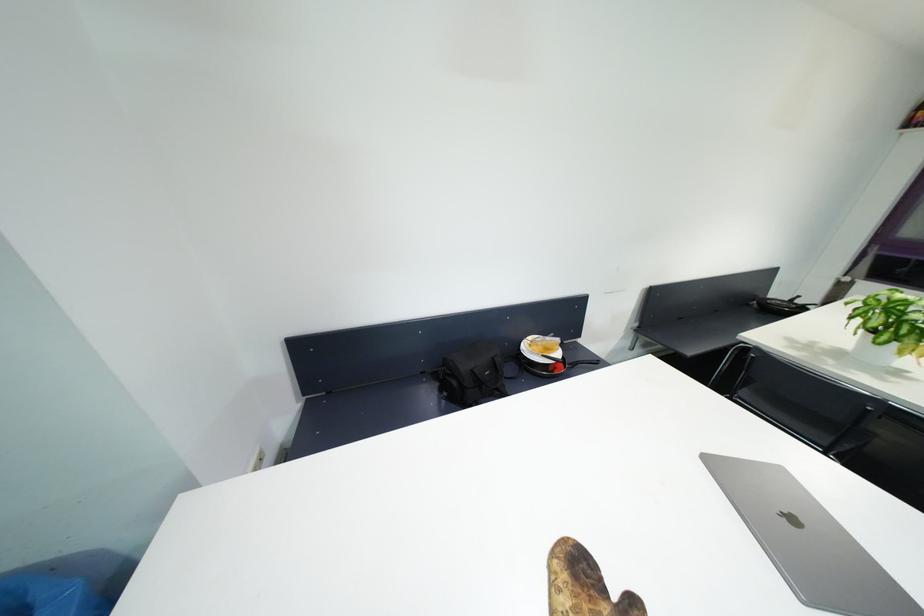
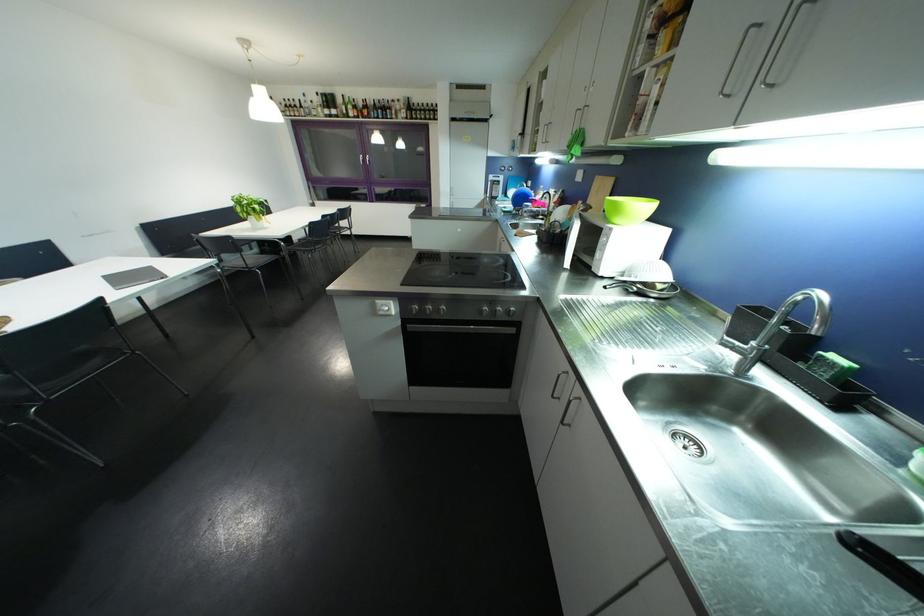
Question: I am providing you with two images of the same scene from different viewpoints. Which of the following objects are not visible in image2?

Choices:
 (A) black sink caddy
 (B) black pan handle
 (C) black ceramic cup
 (D) chair sitting surface

Answer: (B)